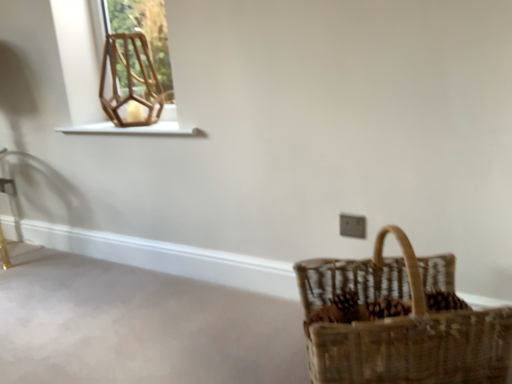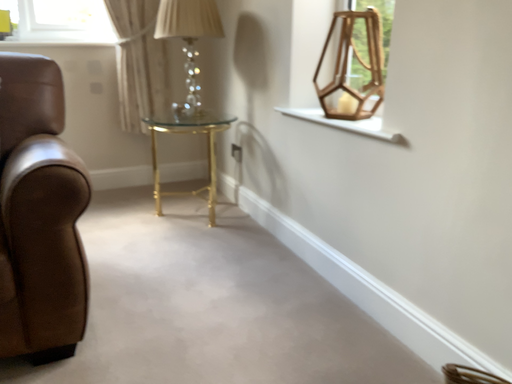
Question: Which way did the camera rotate in the video?

Choices:
 (A) rotated right
 (B) rotated left

Answer: (B)